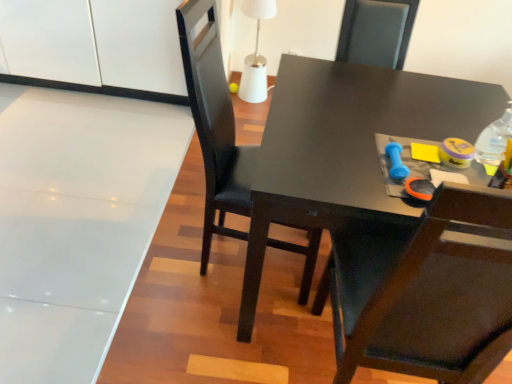
Find the location of `matte black chair at center`. matte black chair at center is located at coordinates (214, 123).

Find the location of a particular element. The height and width of the screenshot is (384, 512). transparent plastic bottle at upper right is located at coordinates (494, 141).

This screenshot has width=512, height=384. Describe the element at coordinates (396, 161) in the screenshot. I see `blue rubber dumbbell at upper right` at that location.

What is the approximate width of white glossy cabinet at upper left?

white glossy cabinet at upper left is 24.78 inches in width.

This screenshot has height=384, width=512. I want to click on matte black chair at center, so click(214, 123).

Could you tell me if transparent plastic bottle at upper right is turned towards blue rubber dumbbell at upper right?

No, transparent plastic bottle at upper right is not facing towards blue rubber dumbbell at upper right.

In the image, is transparent plastic bottle at upper right positioned in front of or behind blue rubber dumbbell at upper right?

transparent plastic bottle at upper right is behind blue rubber dumbbell at upper right.

Considering the relative sizes of transparent plastic bottle at upper right and blue rubber dumbbell at upper right in the image provided, is transparent plastic bottle at upper right smaller than blue rubber dumbbell at upper right?

No.

Which of these two, transparent plastic bottle at upper right or blue rubber dumbbell at upper right, stands taller?

transparent plastic bottle at upper right.

Is blue rubber dumbbell at upper right surrounding transparent plastic bottle at upper right?

No, blue rubber dumbbell at upper right does not contain transparent plastic bottle at upper right.

How many degrees apart are the facing directions of blue rubber dumbbell at upper right and transparent plastic bottle at upper right?

0.00633 degrees separate the facing orientations of blue rubber dumbbell at upper right and transparent plastic bottle at upper right.

Is blue rubber dumbbell at upper right beside transparent plastic bottle at upper right?

No, blue rubber dumbbell at upper right is not touching transparent plastic bottle at upper right.

Does blue rubber dumbbell at upper right have a lesser height compared to transparent plastic bottle at upper right?

Yes.

Considering the relative positions of matte black table at center and blue rubber dumbbell at upper right in the image provided, is matte black table at center to the right of blue rubber dumbbell at upper right from the viewer's perspective?

Yes, matte black table at center is to the right of blue rubber dumbbell at upper right.

Is matte black table at center closer to the viewer compared to blue rubber dumbbell at upper right?

Yes, the depth of matte black table at center is less than that of blue rubber dumbbell at upper right.

Find the location of a particular element. This screenshot has width=512, height=384. toy lying above the matte black table at center (from the image's perspective) is located at coordinates point(396,161).

In the scene shown: Which object is wider, matte black table at center or blue rubber dumbbell at upper right?

matte black table at center.

Visually, is transparent plastic bottle at upper right positioned to the left or to the right of matte black table at center?

transparent plastic bottle at upper right is to the right of matte black table at center.

Can you confirm if transparent plastic bottle at upper right is shorter than matte black table at center?

Yes.

Is transparent plastic bottle at upper right next to matte black table at center and touching it?

No, transparent plastic bottle at upper right is not beside matte black table at center.

From the image's perspective, does transparent plastic bottle at upper right appear lower than matte black table at center?

No, from the image's perspective, transparent plastic bottle at upper right is not below matte black table at center.

Is matte black chair at center not near matte black table at center?

matte black chair at center is actually quite close to matte black table at center.

Could you tell me if matte black chair at center is facing matte black table at center?

Yes, matte black chair at center is turned towards matte black table at center.

From a real-world perspective, which object stands above the other?

From a 3D spatial view, matte black chair at center is above.

Is matte black table at center located within matte black chair at center?

No, matte black table at center is not inside matte black chair at center.

How many degrees apart are the facing directions of matte black table at center and matte black chair at center?

There is a 177-degree angle between the facing directions of matte black table at center and matte black chair at center.

Is matte black table at center positioned beyond the bounds of matte black chair at center?

matte black table at center lies outside matte black chair at center's area.

Is matte black table at center touching matte black chair at center?

No, matte black table at center is not in contact with matte black chair at center.

Considering the positions of objects matte black table at center and matte black chair at center in the image provided, who is in front, matte black table at center or matte black chair at center?

matte black chair at center is in front.

Does point (169, 82) come in front of point (403, 172)?

No, (169, 82) is further to viewer.

Where is `toy to the right of white glossy cabinet at upper left`? This screenshot has height=384, width=512. toy to the right of white glossy cabinet at upper left is located at coordinates (x=396, y=161).

How many degrees apart are the facing directions of white glossy cabinet at upper left and blue rubber dumbbell at upper right?

white glossy cabinet at upper left and blue rubber dumbbell at upper right are facing 177 degrees away from each other.

Could you tell me if white glossy cabinet at upper left is turned towards blue rubber dumbbell at upper right?

No, white glossy cabinet at upper left is not facing towards blue rubber dumbbell at upper right.

Identify the location of toy below the transparent plastic bottle at upper right (from a real-world perspective). (396, 161).

Identify the location of toy in front of the transparent plastic bottle at upper right. (396, 161).

Looking at the image, which one is located closer to blue rubber dumbbell at upper right, matte black chair at center or transparent plastic bottle at upper right?

transparent plastic bottle at upper right is positioned closer to the anchor blue rubber dumbbell at upper right.

Considering their positions, is blue rubber dumbbell at upper right positioned closer to matte black table at center than white glossy cabinet at upper left?

The object closer to matte black table at center is blue rubber dumbbell at upper right.

Based on their spatial positions, is matte black table at center or transparent plastic bottle at upper right closer to blue rubber dumbbell at upper right?

transparent plastic bottle at upper right.

Based on their spatial positions, is matte black chair at center or white glossy cabinet at upper left closer to matte black table at center?

Based on the image, matte black chair at center appears to be nearer to matte black table at center.

Looking at the image, which one is located closer to matte black table at center, white glossy cabinet at upper left or transparent plastic bottle at upper right?

Based on the image, transparent plastic bottle at upper right appears to be nearer to matte black table at center.

Which object lies nearer to the anchor point transparent plastic bottle at upper right, blue rubber dumbbell at upper right or matte black chair at center?

Based on the image, blue rubber dumbbell at upper right appears to be nearer to transparent plastic bottle at upper right.

Estimate the real-world distances between objects in this image. Which object is closer to matte black table at center, white glossy cabinet at upper left or matte black chair at center?

matte black chair at center.

Based on their spatial positions, is white glossy cabinet at upper left or matte black table at center further from matte black chair at center?

white glossy cabinet at upper left is further to matte black chair at center.

Locate an element on the screen. The image size is (512, 384). table located between blue rubber dumbbell at upper right and transparent plastic bottle at upper right in the left-right direction is located at coordinates (346, 148).

You are a GUI agent. You are given a task and a screenshot of the screen. Output one action in this format:
    pyautogui.click(x=<x>, y=<y>)
    Task: Click on the toy between matte black chair at center and transparent plastic bottle at upper right
    This screenshot has height=384, width=512.
    Given the screenshot: What is the action you would take?
    pyautogui.click(x=396, y=161)

Identify the location of chair located between white glossy cabinet at upper left and transparent plastic bottle at upper right in the left-right direction. Image resolution: width=512 pixels, height=384 pixels. (214, 123).

Locate an element on the screen. toy situated between white glossy cabinet at upper left and matte black table at center from left to right is located at coordinates (396, 161).